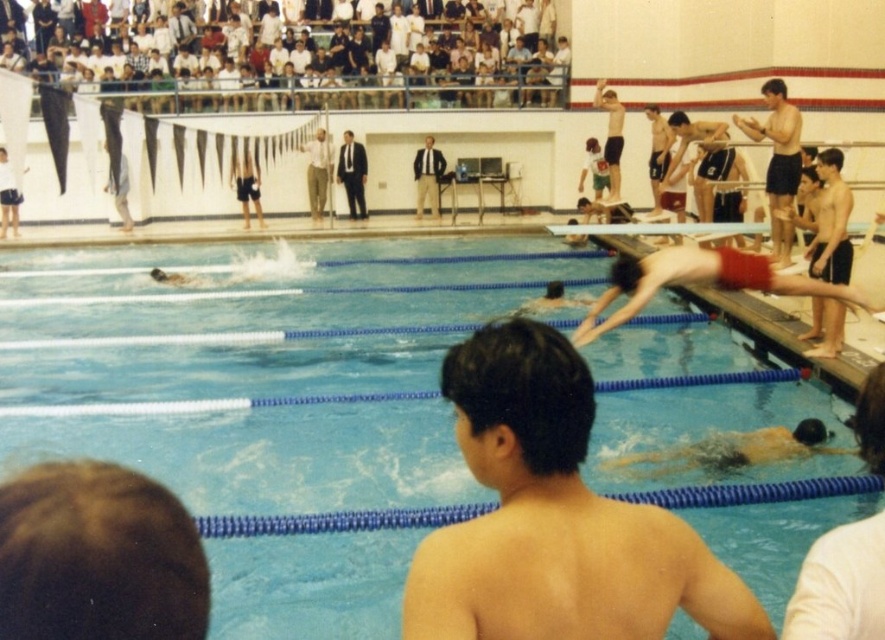
Question: Which point appears closest to the camera in this image?

Choices:
 (A) (606, 428)
 (B) (778, 108)
 (C) (673, 522)
 (D) (666, 136)

Answer: (C)

Question: Can you confirm if dark suit at center is positioned to the right of light brown suit at center?

Choices:
 (A) no
 (B) yes

Answer: (A)

Question: Does smooth skin boy at center appear under dark suit at center?

Choices:
 (A) no
 (B) yes

Answer: (B)

Question: Among these points, which one is nearest to the camera?

Choices:
 (A) [547, 65]
 (B) [429, 612]
 (C) [799, 164]
 (D) [347, 132]

Answer: (B)

Question: Is blue rubber pool at center thinner than smooth black shorts at upper right?

Choices:
 (A) yes
 (B) no

Answer: (B)

Question: Which point is farther to the camera?

Choices:
 (A) dark suit at center
 (B) blue rubber pool at center
 (C) smooth black shorts at upper right
 (D) smooth skin boy at center

Answer: (A)